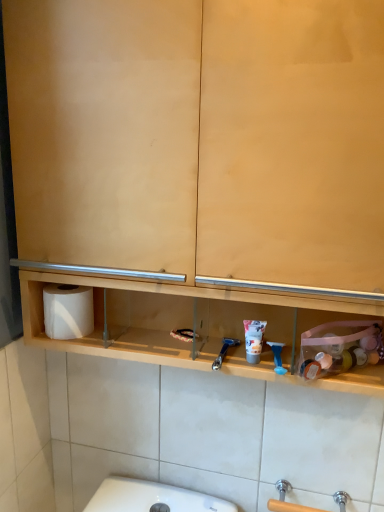
Question: From a real-world perspective, is blue plastic razor at center, marked as the first shower in a right-to-left arrangement, positioned above or below blue plastic razor at center, which is the 2th shower in right-to-left order?

Choices:
 (A) below
 (B) above

Answer: (B)

Question: From their relative heights in the image, would you say blue plastic razor at center, marked as the first shower in a right-to-left arrangement, is taller or shorter than blue plastic razor at center, the first shower viewed from the left?

Choices:
 (A) short
 (B) tall

Answer: (B)

Question: Considering the real-world distances, which object is closest to the white matte toilet paper at left?

Choices:
 (A) matte plastic shaving cream at center
 (B) blue plastic razor at center, the first shower viewed from the left
 (C) blue plastic razor at center, arranged as the 2th shower when viewed from the left

Answer: (B)

Question: Estimate the real-world distances between objects in this image. Which object is closer to the blue plastic razor at center, arranged as the 2th shower when viewed from the left?

Choices:
 (A) white matte toilet paper at left
 (B) blue plastic razor at center, the first shower viewed from the left
 (C) matte plastic shaving cream at center

Answer: (C)